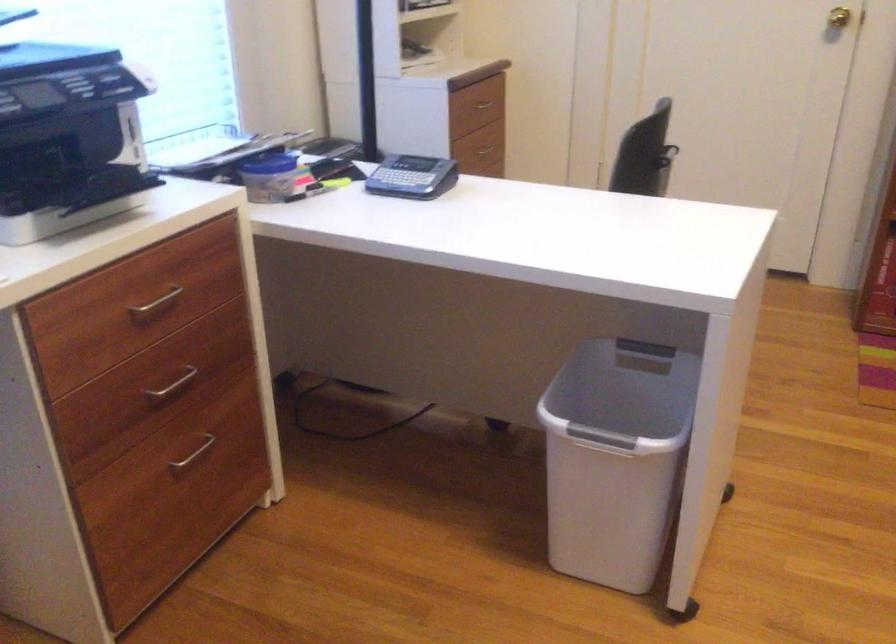
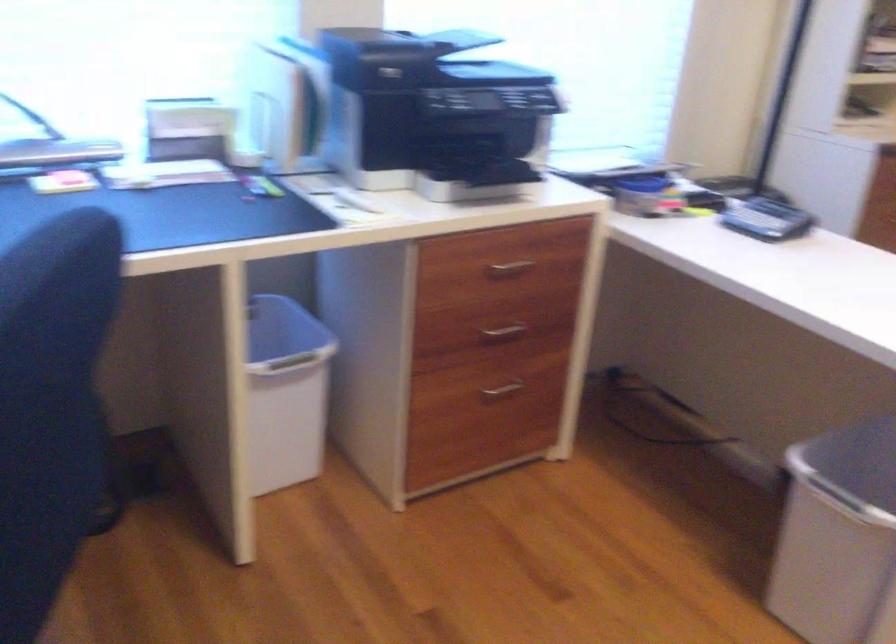
Where in the second image is the point corresponding to the point at 417,174 from the first image?

(767, 220)